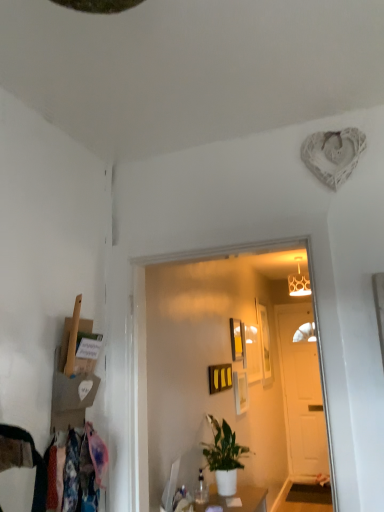
Question: From the image's perspective, is green matte plant at center above yellow matte picture frame at center, which is counted as the 5th picture frame, starting from the back?

Choices:
 (A) no
 (B) yes

Answer: (A)

Question: Is green matte plant at center located outside yellow matte picture frame at center, which is counted as the 5th picture frame, starting from the back?

Choices:
 (A) no
 (B) yes

Answer: (B)

Question: Would you say green matte plant at center is a long distance from yellow matte picture frame at center, which is counted as the 5th picture frame, starting from the back?

Choices:
 (A) yes
 (B) no

Answer: (B)

Question: Is green matte plant at center turned away from yellow matte picture frame at center, which is counted as the 5th picture frame, starting from the back?

Choices:
 (A) yes
 (B) no

Answer: (B)

Question: Does green matte plant at center have a lesser height compared to yellow matte picture frame at center, the first picture frame from the front?

Choices:
 (A) no
 (B) yes

Answer: (A)

Question: Can you confirm if green matte plant at center is wider than yellow matte picture frame at center, the first picture frame from the front?

Choices:
 (A) yes
 (B) no

Answer: (A)

Question: Does matte black picture frame at center, the 3th picture frame when ordered from front to back, contain matte black picture frame at center, marked as the fourth picture frame in a back-to-front arrangement?

Choices:
 (A) yes
 (B) no

Answer: (B)

Question: Can you confirm if matte black picture frame at center, which ranks as the 3th picture frame in back-to-front order, is shorter than matte black picture frame at center, acting as the second picture frame starting from the front?

Choices:
 (A) no
 (B) yes

Answer: (A)

Question: From a real-world perspective, is matte black picture frame at center, the 3th picture frame when ordered from front to back, on top of matte black picture frame at center, marked as the fourth picture frame in a back-to-front arrangement?

Choices:
 (A) no
 (B) yes

Answer: (B)

Question: Is matte black picture frame at center, which ranks as the 3th picture frame in back-to-front order, bigger than matte black picture frame at center, marked as the fourth picture frame in a back-to-front arrangement?

Choices:
 (A) yes
 (B) no

Answer: (A)

Question: Considering the relative positions of matte black picture frame at center, the 3th picture frame when ordered from front to back, and matte black picture frame at center, acting as the second picture frame starting from the front, in the image provided, is matte black picture frame at center, the 3th picture frame when ordered from front to back, to the right of matte black picture frame at center, acting as the second picture frame starting from the front, from the viewer's perspective?

Choices:
 (A) yes
 (B) no

Answer: (B)

Question: Is the depth of matte black picture frame at center, the 3th picture frame when ordered from front to back, less than that of matte black picture frame at center, marked as the fourth picture frame in a back-to-front arrangement?

Choices:
 (A) yes
 (B) no

Answer: (B)

Question: Does wooden picture frame at center, arranged as the 1th picture frame when viewed from the back, appear on the right side of matte gold lampshade at upper center?

Choices:
 (A) yes
 (B) no

Answer: (B)